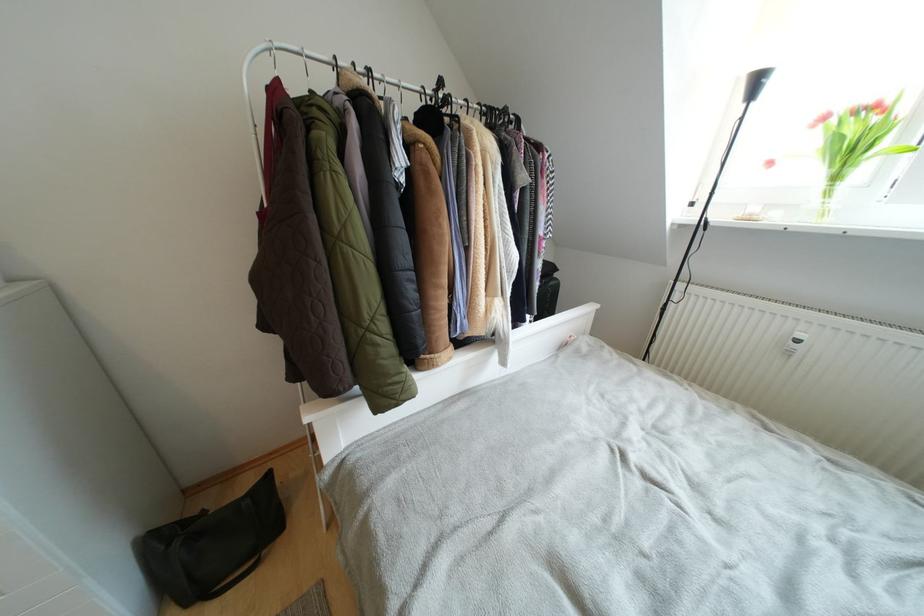
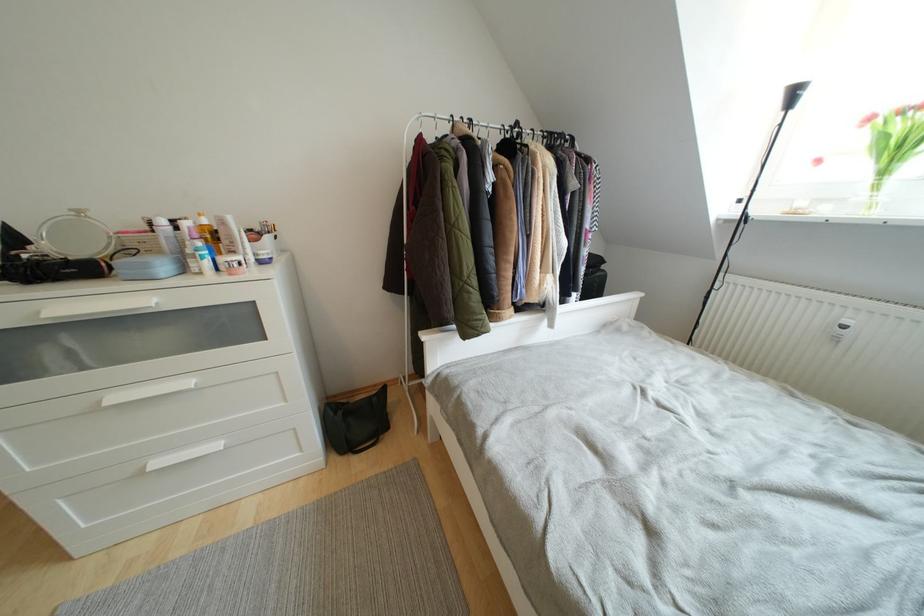
Where in the second image is the point corresponding to (175,549) from the first image?

(341, 416)